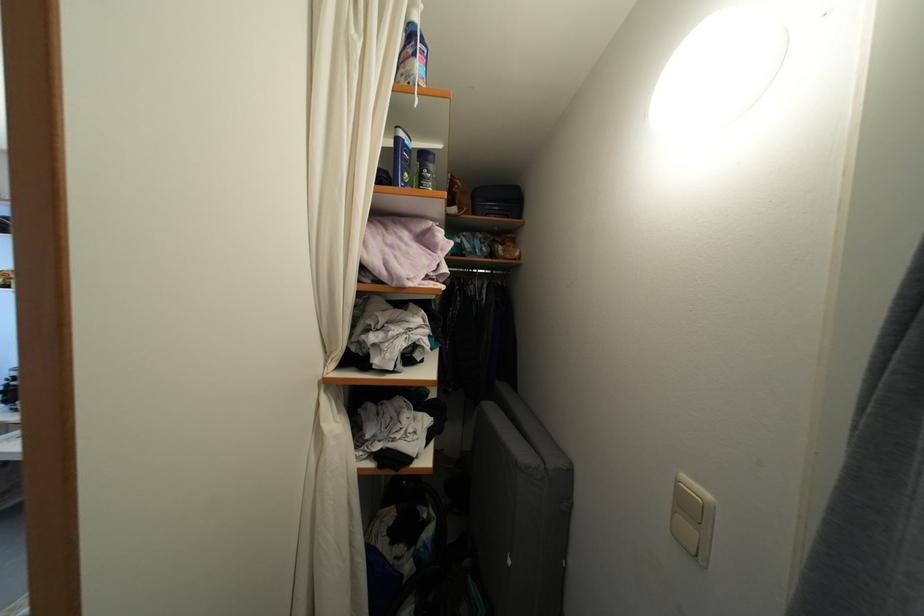
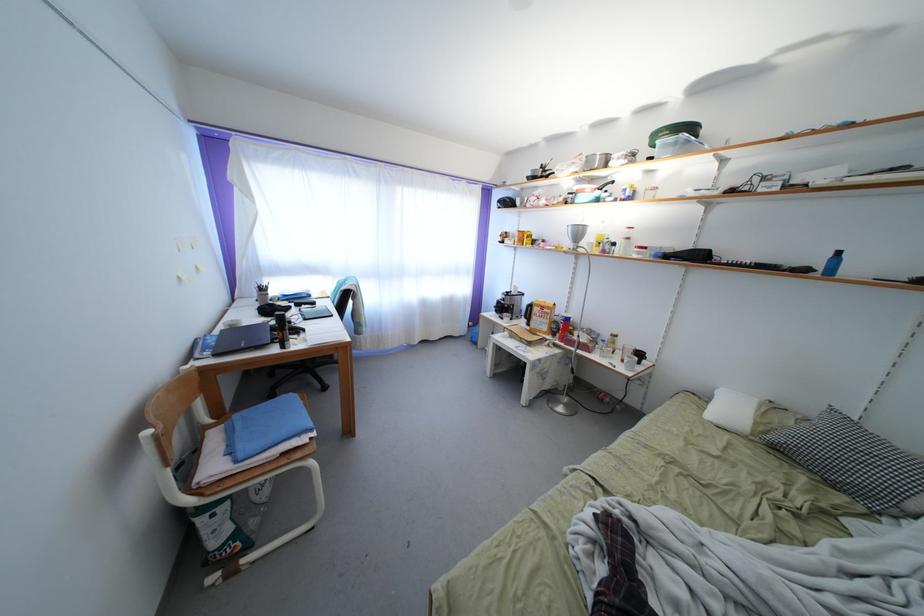
Question: The camera is either moving clockwise (left) or counter-clockwise (right) around the object. The first image is from the beginning of the video and the second image is from the end. Is the camera moving left or right when shooting the video?

Choices:
 (A) Left
 (B) Right

Answer: (B)